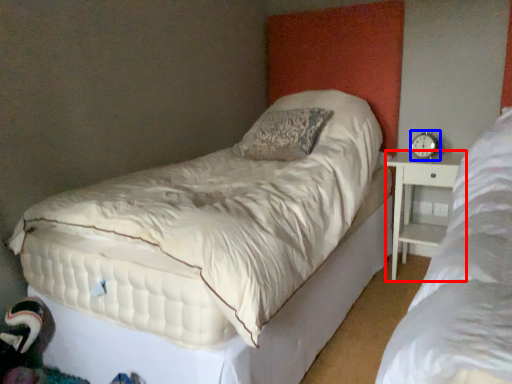
Question: Which object is further to the camera taking this photo, nightstand (highlighted by a red box) or alarm clock (highlighted by a blue box)?

Choices:
 (A) nightstand
 (B) alarm clock

Answer: (B)